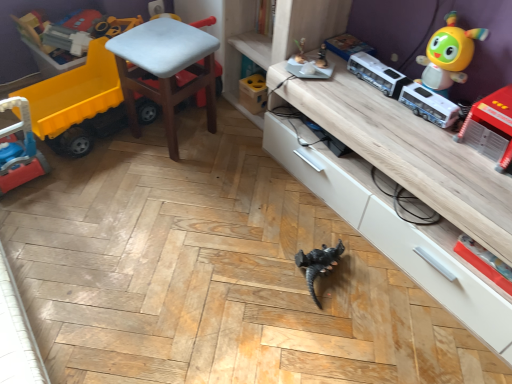
Where is `free space to the left of red plastic fire truck at right, positioned as the fifth toy in left-to-right order`? The height and width of the screenshot is (384, 512). free space to the left of red plastic fire truck at right, positioned as the fifth toy in left-to-right order is located at coordinates (435, 147).